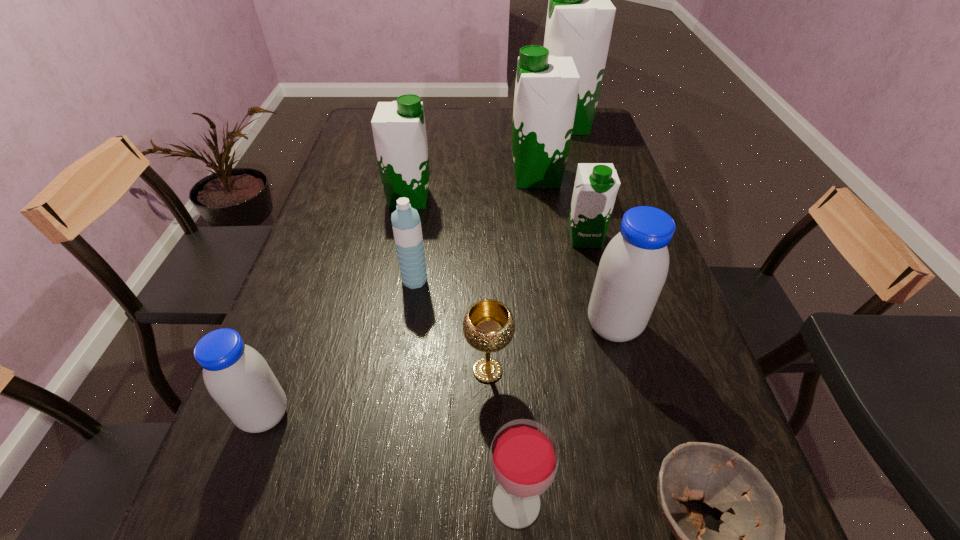
You are a GUI agent. You are given a task and a screenshot of the screen. Output one action in this format:
    pyautogui.click(x=<x>, y=<y>)
    Task: Click on the object situated at the left edge
    This screenshot has width=960, height=540.
    Given the screenshot: What is the action you would take?
    pyautogui.click(x=238, y=378)

Locate an element on the screen. Image resolution: width=960 pixels, height=540 pixels. object at the far right corner is located at coordinates (580, 16).

I want to click on free space at the far edge of the desktop, so click(507, 121).

Identify the location of vacant space at the left edge of the desktop. Image resolution: width=960 pixels, height=540 pixels. (361, 190).

At what (x,y) coordinates should I click in order to perform the action: click on free space at the right edge of the desktop. Please return your answer as a coordinate pair (x, y). Looking at the image, I should click on (592, 157).

This screenshot has width=960, height=540. Find the location of `vacant region between the fourth farthest soya milk and the fifth farthest object`. vacant region between the fourth farthest soya milk and the fifth farthest object is located at coordinates (500, 259).

Locate an element on the screen. This screenshot has height=540, width=960. vacant area that lies between the tallest soya milk and the fourth nearest object is located at coordinates (526, 248).

The image size is (960, 540). I want to click on blank region between the leftmost green soya milk and the second nearest soya milk, so click(511, 262).

You are a GUI agent. You are given a task and a screenshot of the screen. Output one action in this format:
    pyautogui.click(x=<x>, y=<y>)
    Task: Click on the empty space that is in between the right blue soya milk and the fifth soya milk from right to left
    This screenshot has height=540, width=960.
    Given the screenshot: What is the action you would take?
    pyautogui.click(x=511, y=262)

Locate an element on the screen. The image size is (960, 540). vacant point located between the fifth soya milk from right to left and the fifth shortest soya milk is located at coordinates (473, 187).